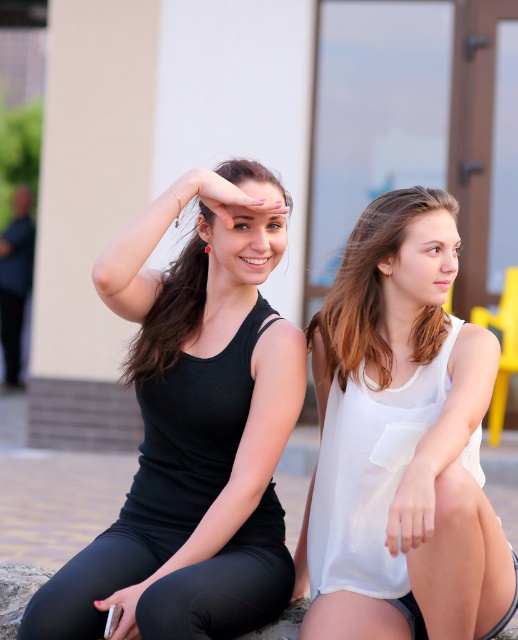
You are a photographer trying to focus on the person wearing a black sleeveless top at left. You notice a point at coordinates [172,308] in the image. Based on the scene description, can you determine if this point is located on the person wearing the black sleeveless top at left?

Yes, the point [172,308] is located on the matte black tank top at left, as stated in the description.

You are standing 20 feet away from the image. Is the point at coordinates point (147,342) closer to you than your current position?

The distance of point (147,342) from viewer is 18.07 feet, so yes, the point at coordinates point (147,342) is closer to you than your current position since 18.07 feet is less than 20 feet.